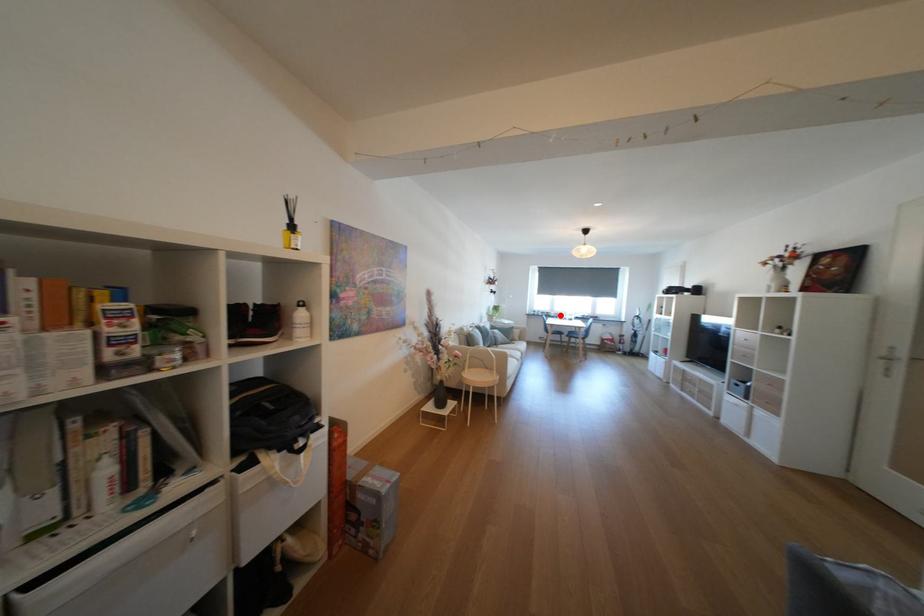
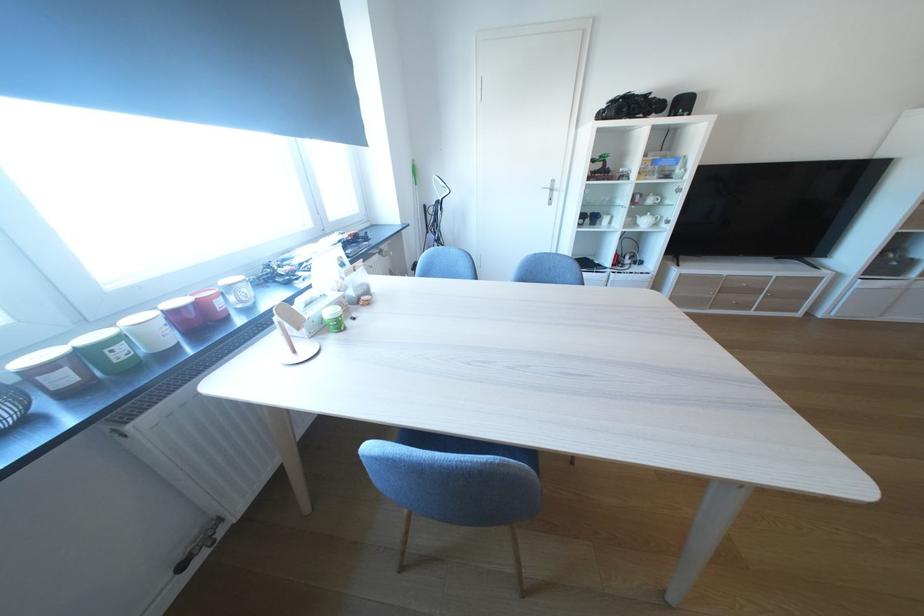
Question: I am providing you with two images of the same scene from different viewpoints. A red point is marked on the first image. Is the red point's position out of view in image 2?

Choices:
 (A) Yes
 (B) No

Answer: (B)